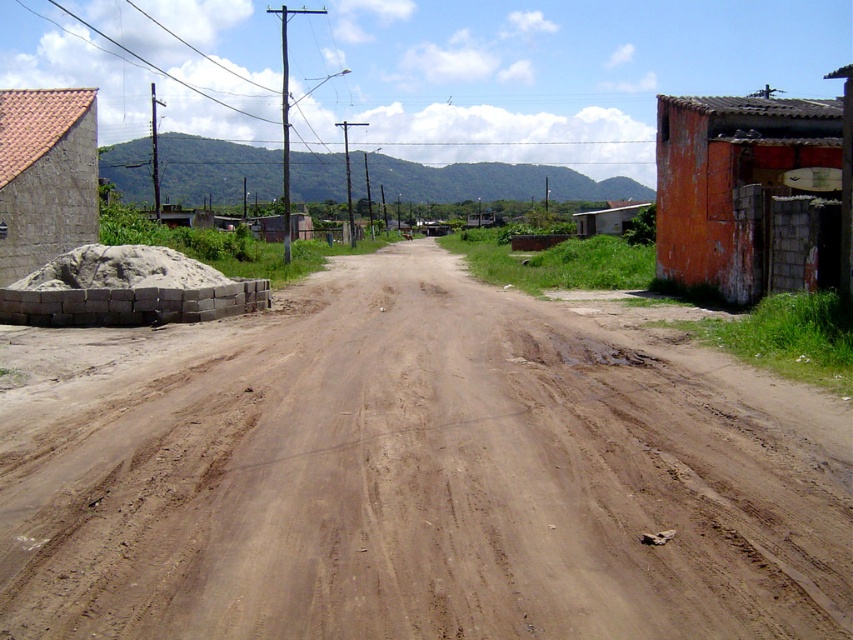
You are a delivery driver who needs to park your truck near the orange painted concrete hut at right without blocking the road. Given the road is narrow, will the height of your truck bed, which is 2 meters tall, be an issue when passing under the red tile roof at left?

The red tile roof at left is taller than the orange painted concrete hut at right. Since the truck bed is 2 meters tall, and the red tile roof at left is taller than the hut, the truck should be able to pass under it without issues.

You are a delivery driver approaching the dirt road and need to turn left at the orange painted concrete hut at right. However, you notice the red tile roof at left in the distance. Which structure will you see first as you drive forward?

The orange painted concrete hut at right will be seen first because it is positioned in front of the red tile roof at left, making it closer to your viewpoint as you drive forward.